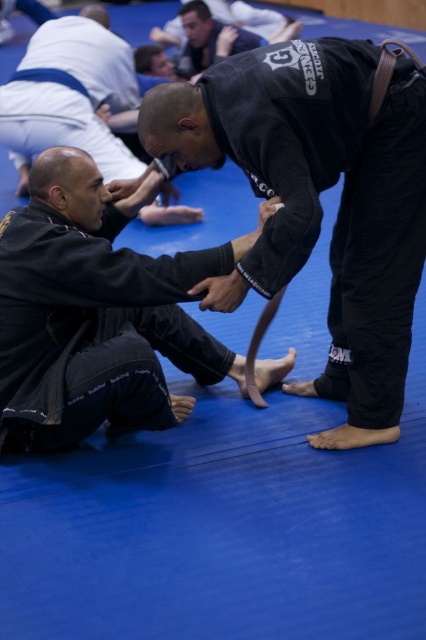
Does black matte gi at lower left have a lesser height compared to black matte gi at center?

Yes.

Is black matte gi at lower left further to camera compared to black matte gi at center?

No, black matte gi at lower left is in front of black matte gi at center.

Which is behind, point (51, 445) or point (121, 163)?

The point (121, 163) is more distant.

The image size is (426, 640). I want to click on black matte gi at lower left, so click(97, 312).

Is black matte uniform at upper center wider than black matte gi at lower left?

No, black matte uniform at upper center is not wider than black matte gi at lower left.

Does black matte uniform at upper center have a lesser width compared to black matte gi at lower left?

Indeed, black matte uniform at upper center has a lesser width compared to black matte gi at lower left.

Is point (339, 220) in front of point (221, 348)?

Yes, point (339, 220) is in front of point (221, 348).

At what (x,y) coordinates should I click in order to perform the action: click on black matte uniform at upper center. Please return your answer as a coordinate pair (x, y). Image resolution: width=426 pixels, height=640 pixels. Looking at the image, I should click on (319, 202).

Can you confirm if black matte uniform at upper center is positioned below black matte gi at center?

Yes.

Can you confirm if black matte uniform at upper center is positioned to the left of black matte gi at center?

Incorrect, black matte uniform at upper center is not on the left side of black matte gi at center.

What are the coordinates of `black matte uniform at upper center` in the screenshot? It's located at (319, 202).